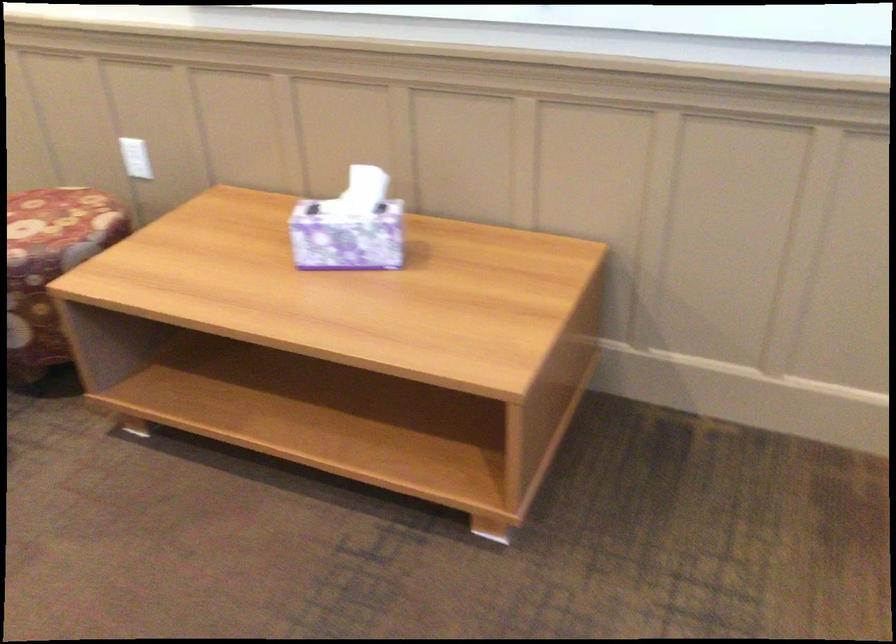
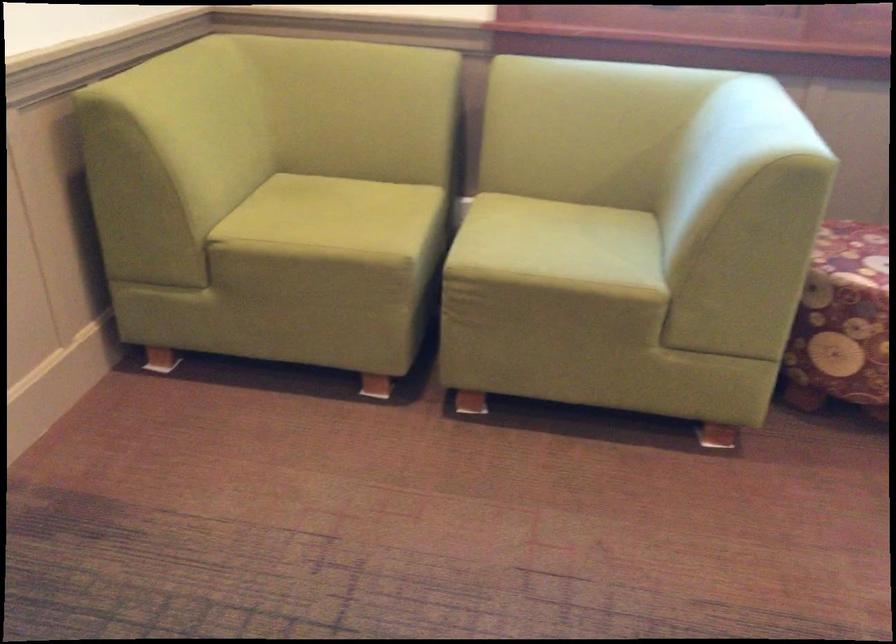
Based on the continuous images, in which direction is the camera rotating?

The camera rotated toward right-down.